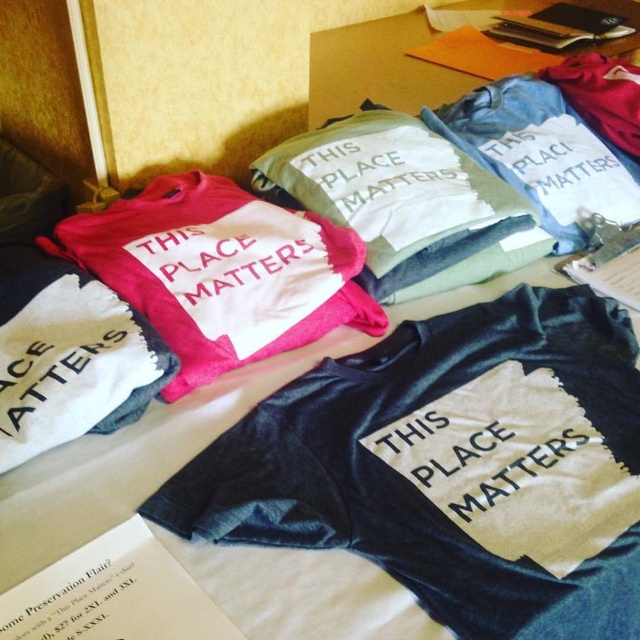
This screenshot has width=640, height=640. What do you see at coordinates (221, 272) in the screenshot?
I see `matte pink t-shirt at center` at bounding box center [221, 272].

Identify the location of matte pink t-shirt at center. (221, 272).

At what (x,y) coordinates should I click in order to perform the action: click on matte pink t-shirt at center. Please return your answer as a coordinate pair (x, y). The width and height of the screenshot is (640, 640). Looking at the image, I should click on (221, 272).

Is black cotton t-shirt at center above matte pink t-shirt at center?

No.

What do you see at coordinates (452, 467) in the screenshot?
I see `black cotton t-shirt at center` at bounding box center [452, 467].

Is point (276, 508) in front of point (312, 269)?

Yes, point (276, 508) is closer to viewer.

Find the location of a particular element. The height and width of the screenshot is (640, 640). black cotton t-shirt at center is located at coordinates (452, 467).

Is the position of black cotton t-shirt at center less distant than that of blue cotton jeans at upper right?

Yes, black cotton t-shirt at center is closer to the viewer.

What do you see at coordinates (452, 467) in the screenshot?
I see `black cotton t-shirt at center` at bounding box center [452, 467].

This screenshot has width=640, height=640. What are the coordinates of `black cotton t-shirt at center` in the screenshot? It's located at (452, 467).